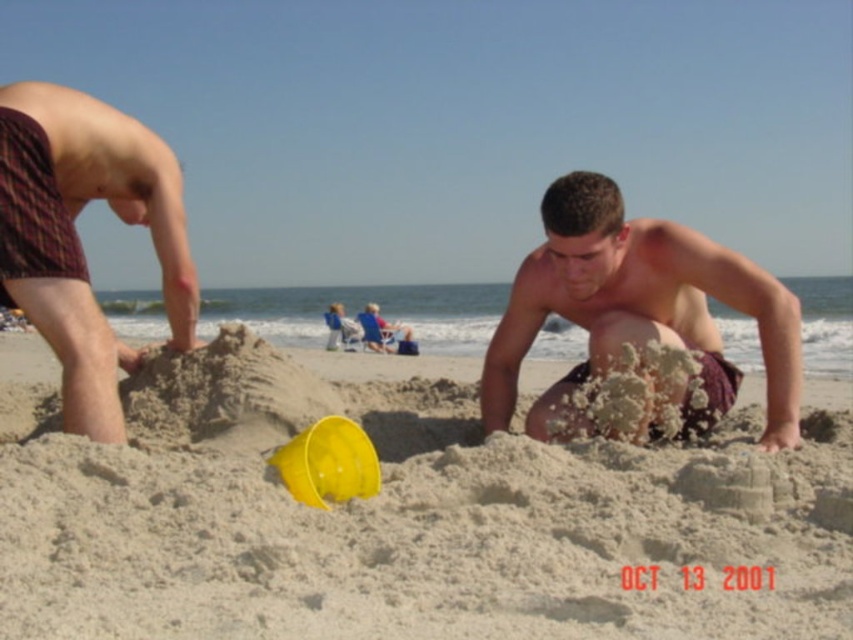
Is beige sand at center to the right of smooth tan skin at center from the viewer's perspective?

Incorrect, beige sand at center is not on the right side of smooth tan skin at center.

Describe the element at coordinates (401, 516) in the screenshot. I see `beige sand at center` at that location.

Who is more distant from viewer, (74, 568) or (627, 269)?

Point (627, 269)

Locate an element on the screen. This screenshot has width=853, height=640. beige sand at center is located at coordinates (401, 516).

Is smooth tan skin at center below plaid fabric shorts at left?

Indeed, smooth tan skin at center is positioned under plaid fabric shorts at left.

Who is higher up, smooth tan skin at center or plaid fabric shorts at left?

Positioned higher is plaid fabric shorts at left.

Describe the element at coordinates (637, 307) in the screenshot. I see `smooth tan skin at center` at that location.

I want to click on smooth tan skin at center, so click(x=637, y=307).

In the scene shown: Is beige sand at center further to camera compared to plaid fabric shorts at left?

No, it is in front of plaid fabric shorts at left.

Can you confirm if beige sand at center is smaller than plaid fabric shorts at left?

Correct, beige sand at center occupies less space than plaid fabric shorts at left.

Who is more forward, (627, 493) or (169, 276)?

Point (627, 493) is more forward.

Locate an element on the screen. The width and height of the screenshot is (853, 640). beige sand at center is located at coordinates (401, 516).